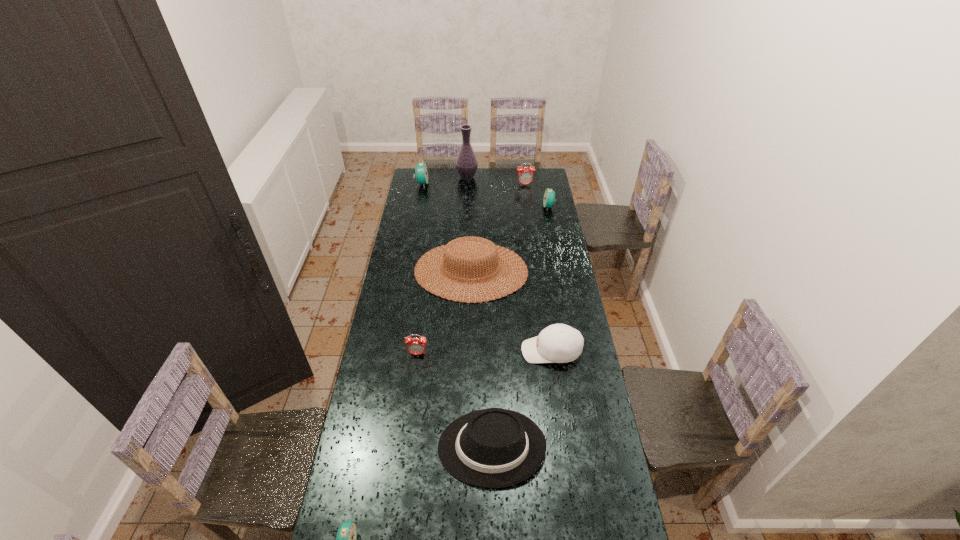
This screenshot has height=540, width=960. Identify the location of empty space between the sunhat and the fourth farthest object. (510, 239).

Identify which object is the seventh closest to the fifth nearest object. Please provide its 2D coordinates. Your answer should be formatted as a tuple, i.e. [(x, y)], where the tuple contains the x and y coordinates of a point satisfying the conditions above.

[(466, 163)]

You are a GUI agent. You are given a task and a screenshot of the screen. Output one action in this format:
    pyautogui.click(x=<x>, y=<y>)
    Task: Click on the object that is the nearest to the tallest object
    The image size is (960, 540).
    Given the screenshot: What is the action you would take?
    pyautogui.click(x=421, y=171)

Identify which alarm clock is the nearest to the white baseball cap. Please provide its 2D coordinates. Your answer should be formatted as a tuple, i.e. [(x, y)], where the tuple contains the x and y coordinates of a point satisfying the conditions above.

[(416, 346)]

Where is `alarm clock that is the third closest to the sunhat`? Image resolution: width=960 pixels, height=540 pixels. alarm clock that is the third closest to the sunhat is located at coordinates (421, 171).

Identify which blue alarm clock is the second closest to the vase. Please provide its 2D coordinates. Your answer should be formatted as a tuple, i.e. [(x, y)], where the tuple contains the x and y coordinates of a point satisfying the conditions above.

[(549, 196)]

In order to click on blue alarm clock object that ranks as the second closest to the beige sunhat in this screenshot , I will do `click(421, 171)`.

Select which red alarm clock is the closest to the white baseball cap. Please provide its 2D coordinates. Your answer should be formatted as a tuple, i.e. [(x, y)], where the tuple contains the x and y coordinates of a point satisfying the conditions above.

[(416, 346)]

Identify the location of vacant space that satisfies the following two spatial constraints: 1. on the front-facing side of the rightmost alarm clock; 2. on the face of the nearer red alarm clock. The image size is (960, 540). (579, 354).

Where is `vacant space that satisfies the following two spatial constraints: 1. on the front-facing side of the beige sunhat; 2. on the right side of the biggest blue alarm clock`? The width and height of the screenshot is (960, 540). vacant space that satisfies the following two spatial constraints: 1. on the front-facing side of the beige sunhat; 2. on the right side of the biggest blue alarm clock is located at coordinates (406, 271).